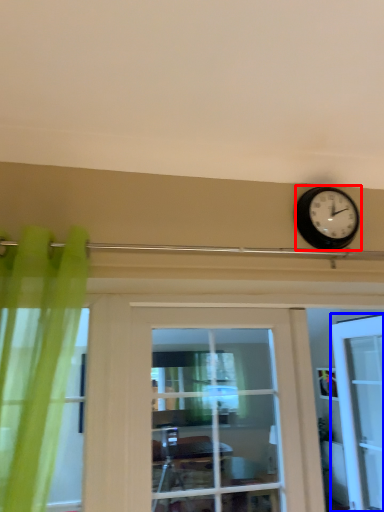
Question: Among these objects, which one is nearest to the camera, wall clock (highlighted by a red box) or door (highlighted by a blue box)?

Choices:
 (A) wall clock
 (B) door

Answer: (A)